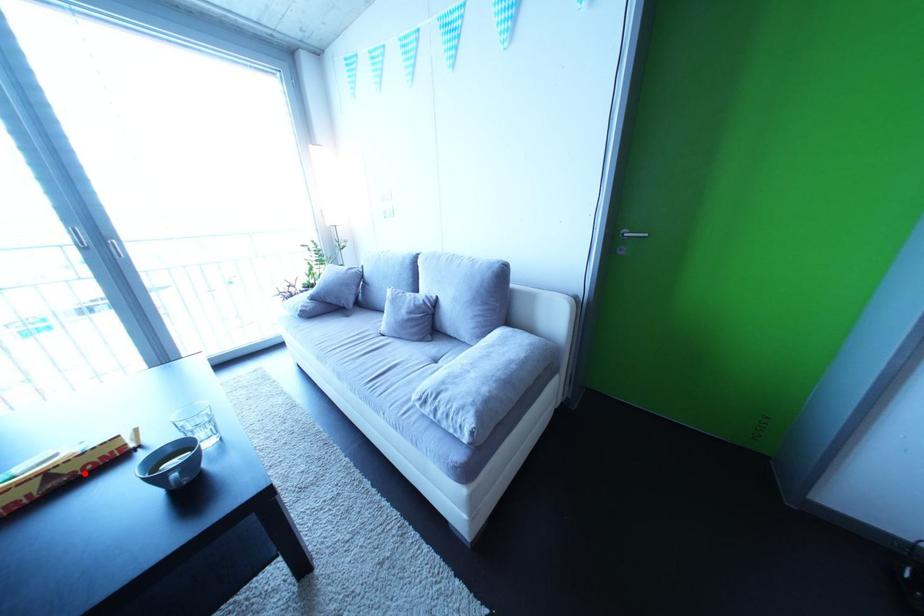
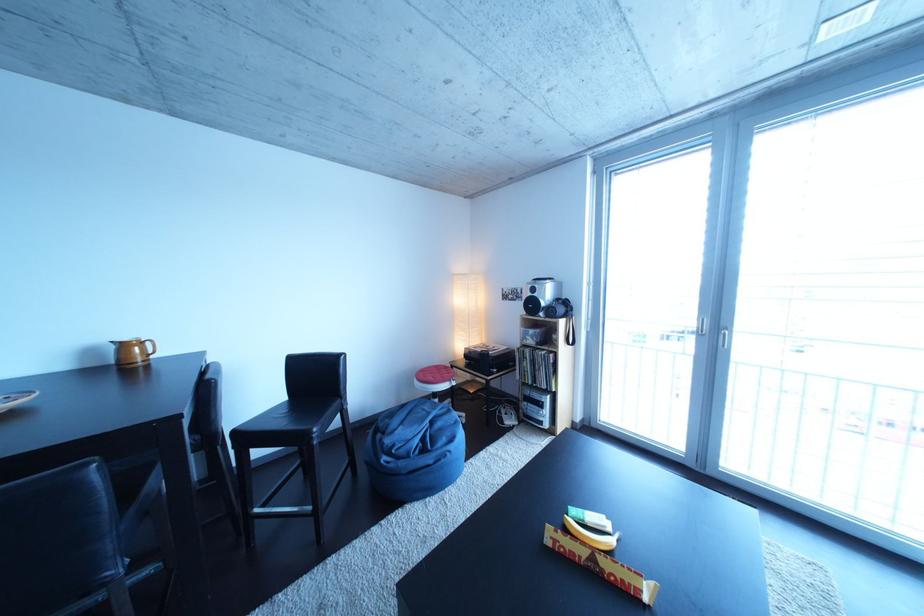
The point at the highlighted location is marked in the first image. Where is the corresponding point in the second image?

(617, 570)